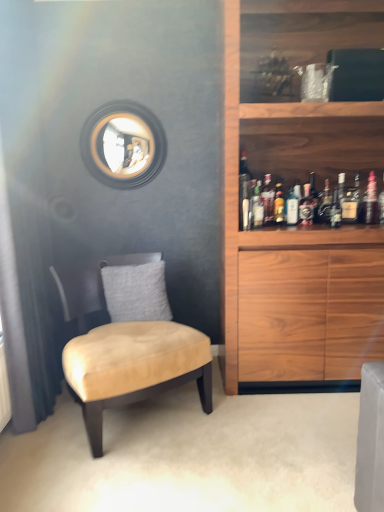
Question: Visually, is translucent glass bottle at upper right, which is counted as the seventh bottle, starting from the left, positioned to the left or to the right of translucent glass bottle at upper right, which is the sixth bottle from left to right?

Choices:
 (A) right
 (B) left

Answer: (A)

Question: Considering their positions, is translucent glass bottle at upper right, placed as the third bottle when sorted from right to left, located in front of or behind translucent glass bottle at upper right, which is the sixth bottle from left to right?

Choices:
 (A) behind
 (B) front

Answer: (B)

Question: Which is nearer to the clear glass bottle at upper right, which ranks as the first bottle in left-to-right order?

Choices:
 (A) gray fuzzy pillow at center
 (B) translucent glass bottle at upper right, placed as the third bottle when sorted from right to left
 (C) translucent glass bottle at upper right, which is the 3th bottle from left to right
 (D) suede-like beige chair at left
 (E) translucent glass bottle at upper right, which is the sixth bottle from left to right

Answer: (C)

Question: Which object is positioned farthest from the translucent glass bottle at shelf center, which is the sixth bottle in right-to-left order?

Choices:
 (A) translucent glass bottle at upper right, which appears as the 7th bottle when viewed from the right
 (B) translucent glass bottle at upper right, which is the eighth bottle from left to right
 (C) translucent glass bottle at upper right, which is counted as the seventh bottle, starting from the left
 (D) translucent glass bottle at center, which appears as the fifth bottle when viewed from the right
 (E) clear glass bottle at upper right, positioned as the ninth bottle in right-to-left order

Answer: (B)